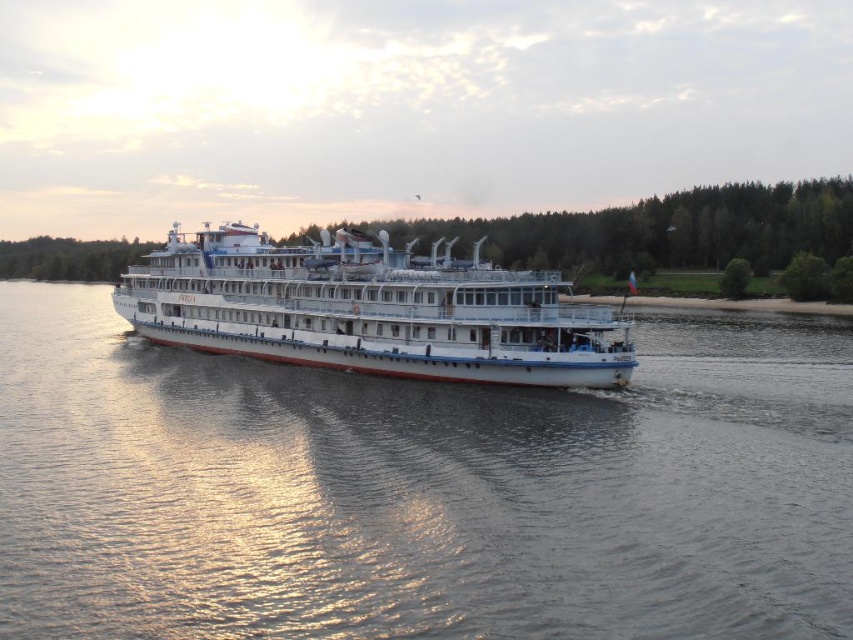
You are standing on the deck of the white glossy cruise ship at center and looking towards the direction of the white glossy water at center. Which side of the ship are you facing?

Since the white glossy water at center is to the right of the white glossy cruise ship at center, when standing on the ship and facing the water, you are facing towards the right side of the ship.

You are a photographer on the deck of the white glossy cruise ship at center. You want to capture a photo of the white glossy water at center in the foreground. Given their sizes, will the cruise ship at center block the water from view?

The white glossy water at center is smaller than the white glossy cruise ship at center, so the cruise ship will block the water from view.